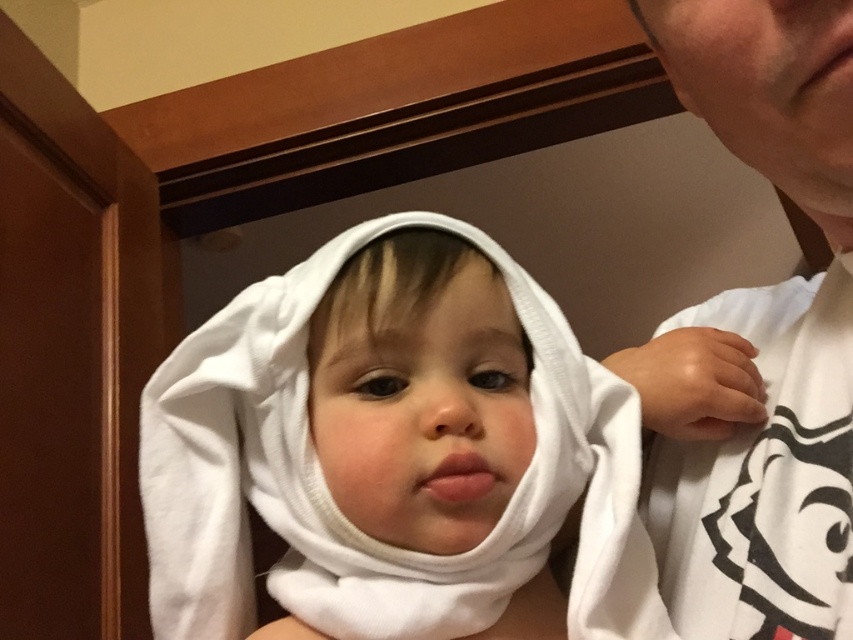
Question: Is white soft cloth at center below white cotton shirt at upper right?

Choices:
 (A) no
 (B) yes

Answer: (B)

Question: Among these points, which one is farthest from the camera?

Choices:
 (A) (245, 323)
 (B) (772, 502)

Answer: (A)

Question: Can you confirm if white soft cloth at center is positioned below white cotton shirt at upper right?

Choices:
 (A) no
 (B) yes

Answer: (B)

Question: Which point is closer to the camera?

Choices:
 (A) (334, 532)
 (B) (618, 355)

Answer: (A)

Question: Which of the following is the farthest from the observer?

Choices:
 (A) white soft cloth at center
 (B) white cotton shirt at upper right

Answer: (A)

Question: Can you confirm if white soft cloth at center is bigger than white cotton shirt at upper right?

Choices:
 (A) no
 (B) yes

Answer: (A)